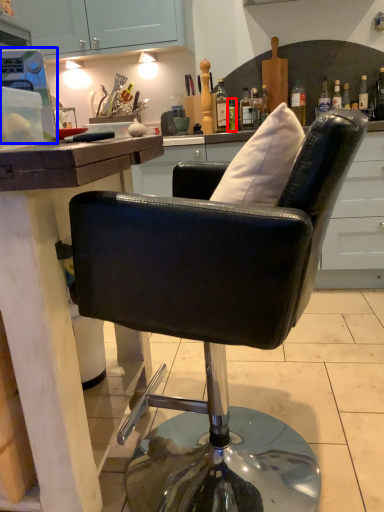
Question: Which object appears closest to the camera in this image, bottle (highlighted by a red box) or appliance (highlighted by a blue box)?

Choices:
 (A) bottle
 (B) appliance

Answer: (B)